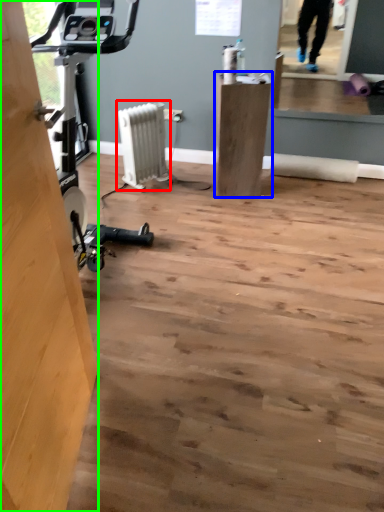
Question: Estimate the real-world distances between objects in this image. Which object is farther from radiator (highlighted by a red box), furniture (highlighted by a blue box) or plywood (highlighted by a green box)?

Choices:
 (A) furniture
 (B) plywood

Answer: (B)